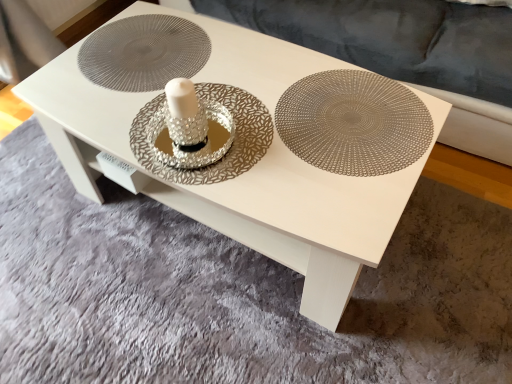
Question: Is metallic silver doily at center situated inside metallic silver plate at center or outside?

Choices:
 (A) inside
 (B) outside

Answer: (B)

Question: From the image's perspective, is metallic silver doily at center located above or below metallic silver plate at center?

Choices:
 (A) above
 (B) below

Answer: (A)

Question: Based on their relative distances, which object is farther from the velvet grey couch at upper center?

Choices:
 (A) metallic silver plate at center
 (B) metallic silver doily at center

Answer: (B)

Question: Which of these objects is positioned closest to the metallic silver plate at center?

Choices:
 (A) velvet grey couch at upper center
 (B) metallic silver doily at center

Answer: (B)